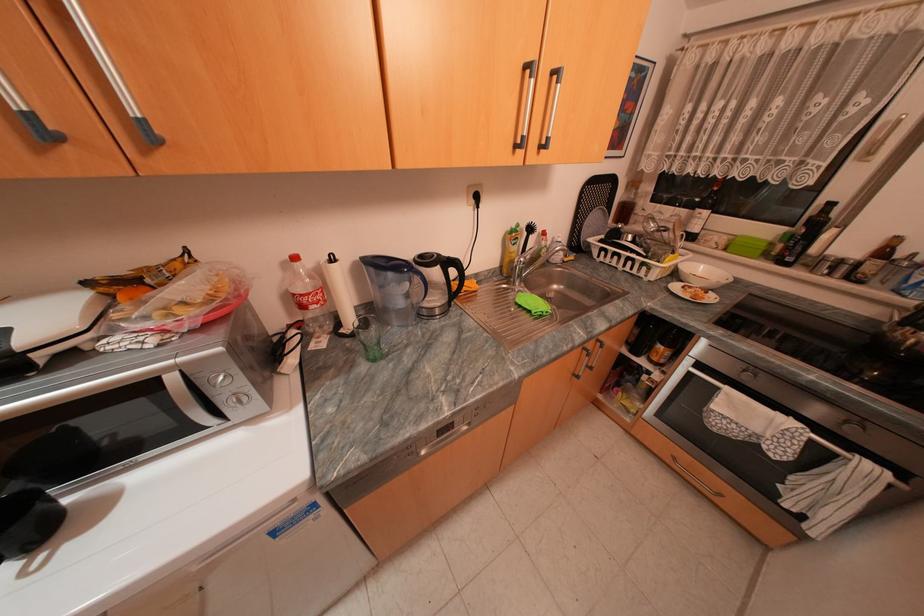
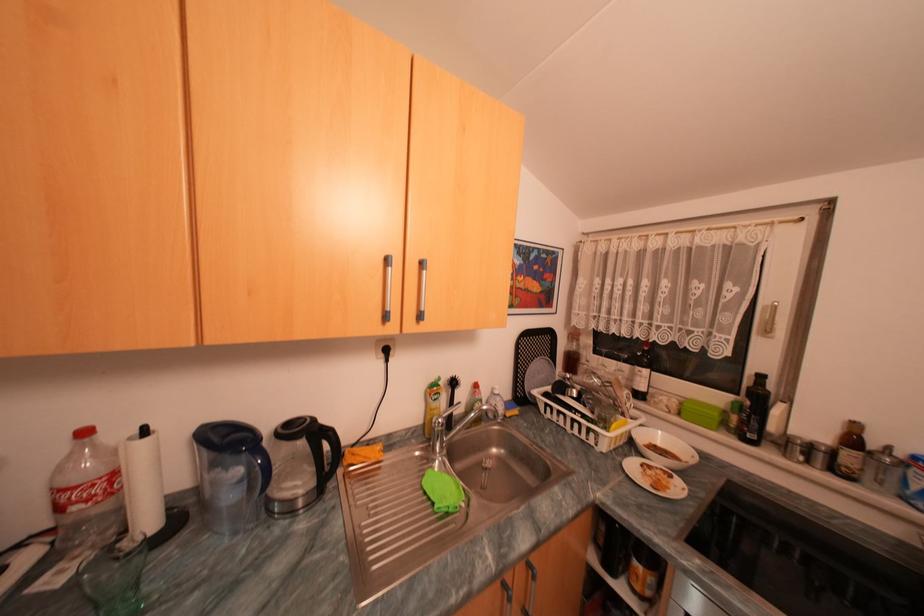
In the second image, find the point that corresponds to pixel 463 270 in the first image.

(334, 445)